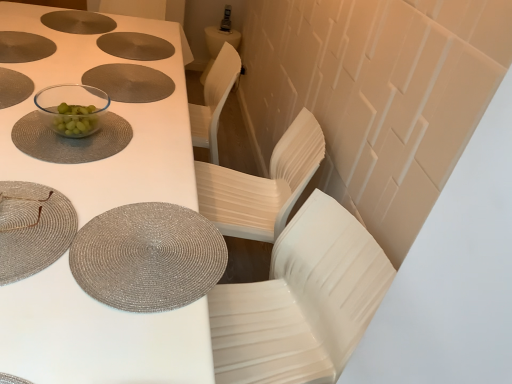
At what (x,y) coordinates should I click in order to perform the action: click on vacant area that lies between silver woven placemat at lower left, positioned as the 5th tableware in back-to-front order, and transparent glass bowl at center, placed as the third tableware when sorted from back to front. Please return your answer as a coordinate pair (x, y). Image resolution: width=512 pixels, height=384 pixels. Looking at the image, I should click on (65, 176).